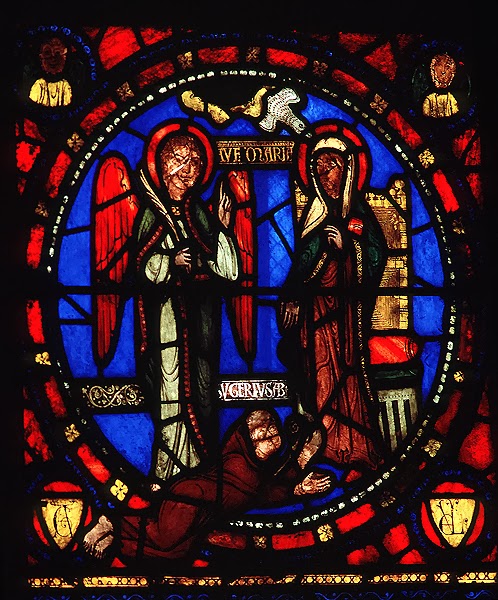
You are a GUI agent. You are given a task and a screenshot of the screen. Output one action in this format:
    pyautogui.click(x=<x>, y=<y>)
    Task: Click on the robes
    This screenshot has height=600, width=498.
    Given the screenshot: What is the action you would take?
    pyautogui.click(x=240, y=480), pyautogui.click(x=173, y=323), pyautogui.click(x=340, y=344)